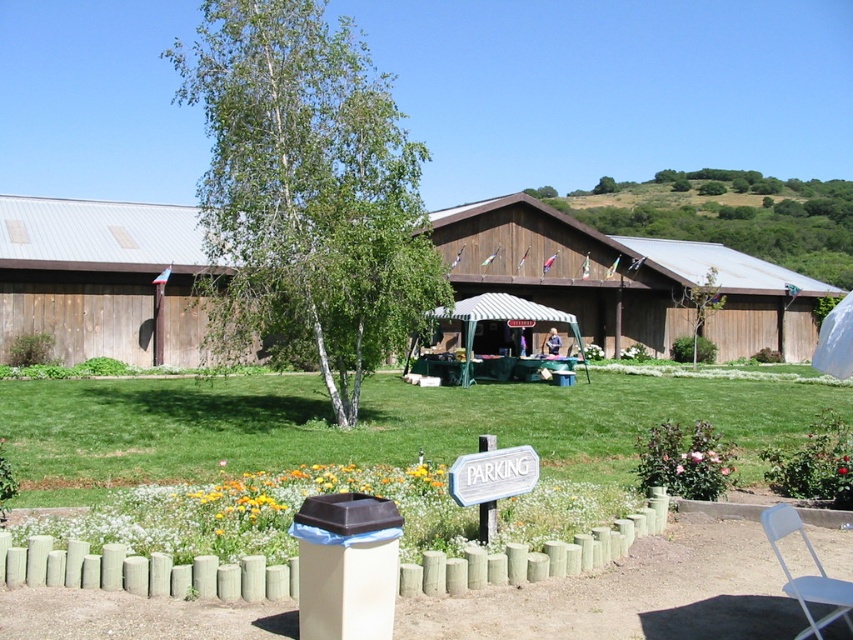
You are a gardener who needs to place a new flower pot between the green wooden fence at lower center and the white plastic chair at lower right. Which object should the flower pot be placed closer to if it needs to be positioned at a height that matches the taller object?

The flower pot should be placed closer to the white plastic chair at lower right because it is taller than the green wooden fence at lower center.